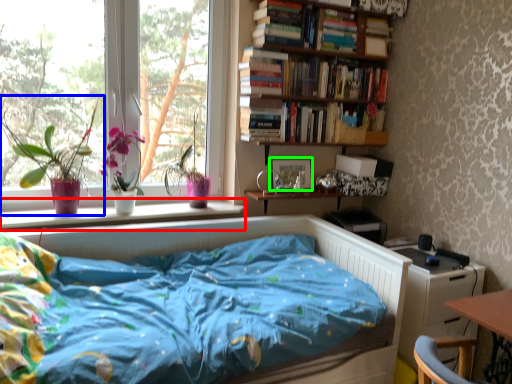
Question: Estimate the real-world distances between objects in this image. Which object is farther from window sill (highlighted by a red box), houseplant (highlighted by a blue box) or picture frame (highlighted by a green box)?

Choices:
 (A) houseplant
 (B) picture frame

Answer: (B)